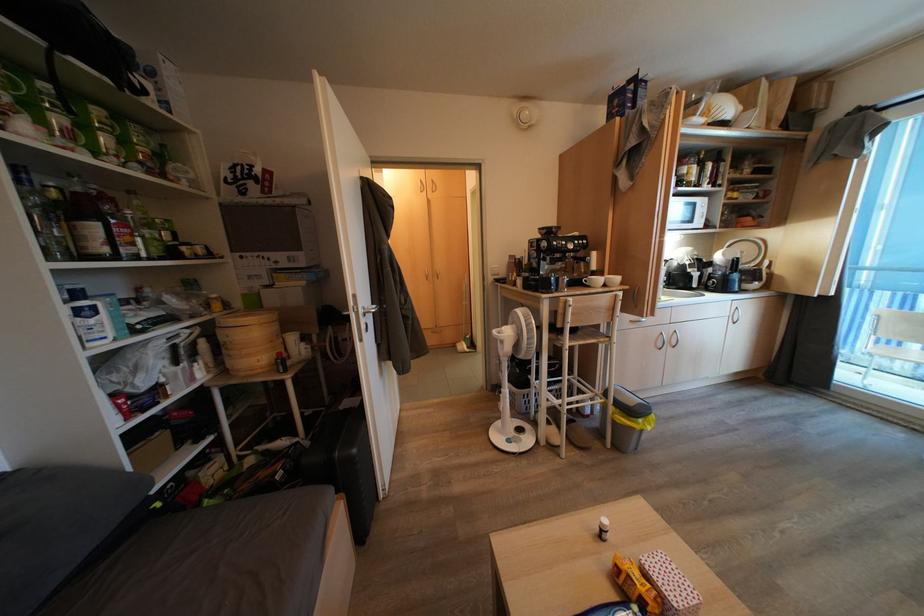
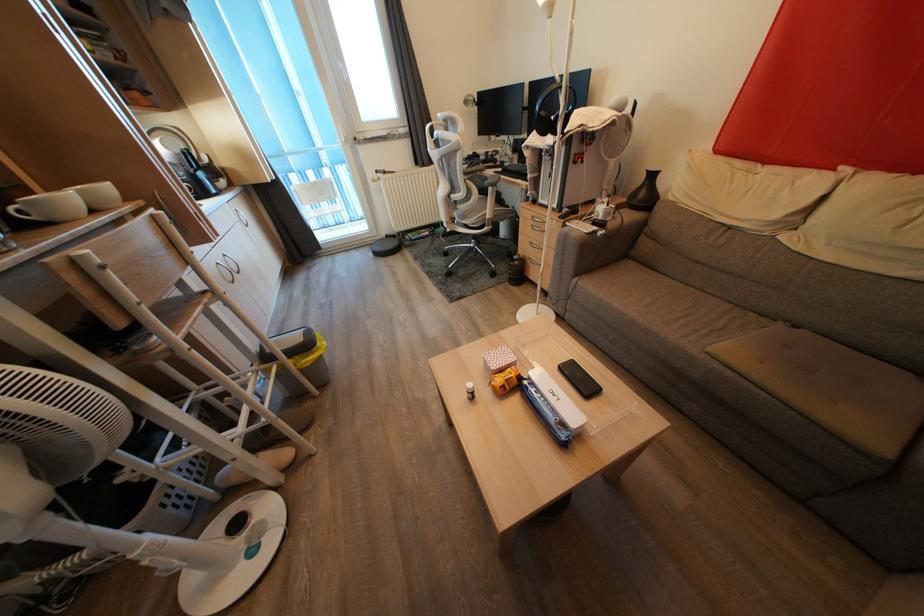
Based on the continuous images, in which direction is the camera rotating?

The rotation direction of the camera is right-down.